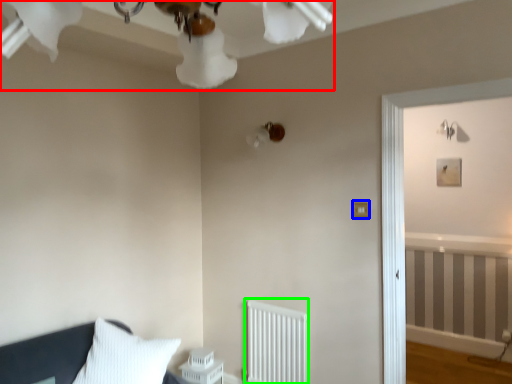
Question: Which object is the farthest from light fixture (highlighted by a red box)? Choose among these: light switch (highlighted by a blue box) or radiator (highlighted by a green box).

Choices:
 (A) light switch
 (B) radiator

Answer: (B)